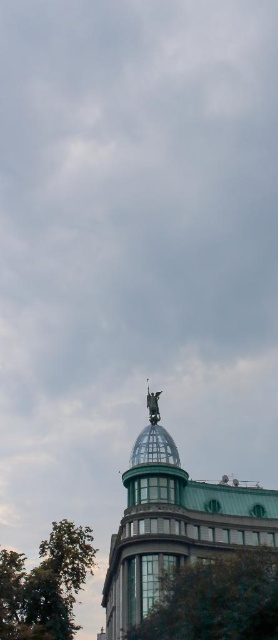
Question: Which point appears closest to the camera in this image?

Choices:
 (A) (217, 524)
 (B) (55, 614)
 (C) (209, 620)

Answer: (C)

Question: Based on their relative distances, which object is farther from the green leafy tree at lower left?

Choices:
 (A) green leafy tree at lower center
 (B) polished bronze statue at center

Answer: (A)

Question: Is green leafy tree at lower left further to the viewer compared to polished bronze statue at top?

Choices:
 (A) no
 (B) yes

Answer: (A)

Question: Does green leafy tree at lower left appear over polished bronze statue at top?

Choices:
 (A) no
 (B) yes

Answer: (A)

Question: Does polished bronze statue at center have a smaller size compared to green leafy tree at lower center?

Choices:
 (A) yes
 (B) no

Answer: (B)

Question: Among these objects, which one is nearest to the camera?

Choices:
 (A) polished bronze statue at center
 (B) polished bronze statue at top
 (C) green leafy tree at lower center
 (D) green leafy tree at lower left

Answer: (C)